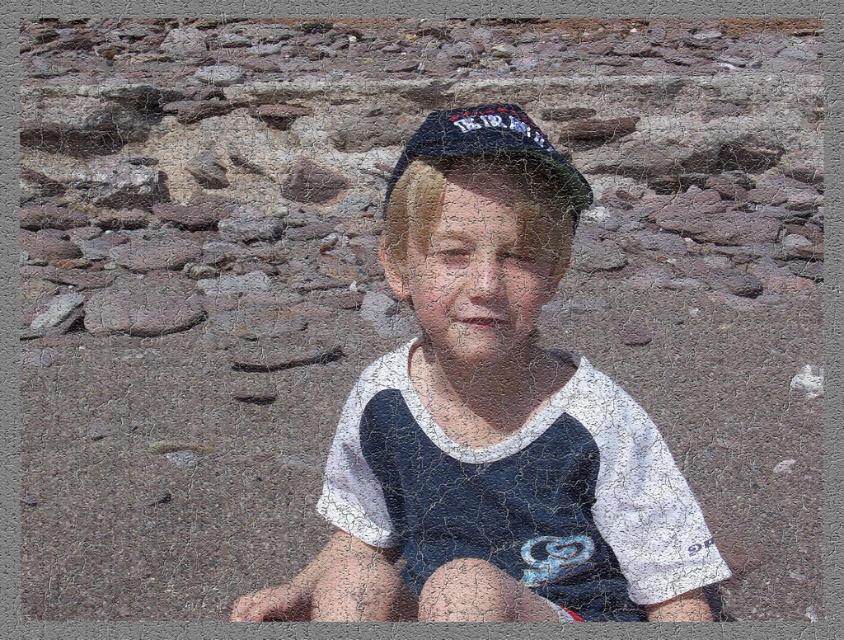
Can you confirm if white cotton shirt at center is positioned to the left of dark blue fabric baseball hat at center?

Correct, you'll find white cotton shirt at center to the left of dark blue fabric baseball hat at center.

I want to click on white cotton shirt at center, so click(493, 420).

Who is more forward, (544, 356) or (556, 173)?

Point (556, 173) is in front.

The width and height of the screenshot is (844, 640). What are the coordinates of `white cotton shirt at center` in the screenshot? It's located at (493, 420).